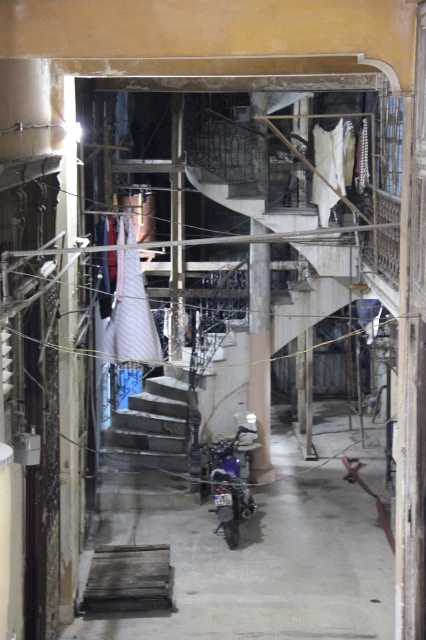
You are a delivery person with a 7.5 feet wide package that needs to be transported through the alley. The alley has a white fabric at center and a shiny blue motorcycle at center. Can you safely pass through the narrowest point between these two objects with your package?

The distance between the white fabric at center and the shiny blue motorcycle at center is 8.37 feet, which is wider than your 7.5 feet wide package. Therefore, you can safely pass through the narrowest point between them with your package.

You are a delivery person trying to navigate through the alley. You see the white fabric at center and the shiny blue motorcycle at center. Which object is wider?

Result: The white fabric at center is wider than the shiny blue motorcycle at center.

You are a delivery person carrying a large package that is 1.5 meters wide. You need to navigate through the narrow alleyway shown in the image. Can you pass through the space between the concrete stairs at center and the smooth concrete pillar at center without tilting the package?

The concrete stairs at center are wider than the smooth concrete pillar at center. However, since the alleyway is narrow and the exact width between them isn not specified in the Objects Description, it is uncertain if the 1.5 meter wide package can fit. Please check the actual space before proceeding.